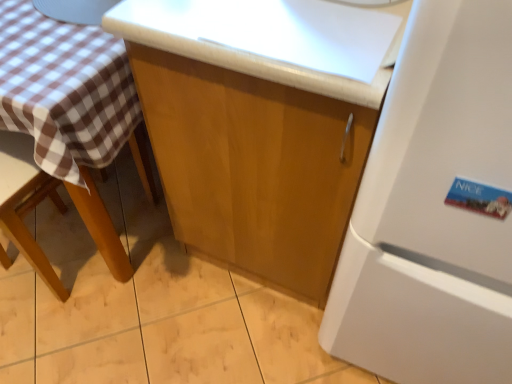
Find the location of a particular element. The image size is (512, 384). vacant space in between glossy wood cabinet at center and brown wooden chair at left is located at coordinates (159, 268).